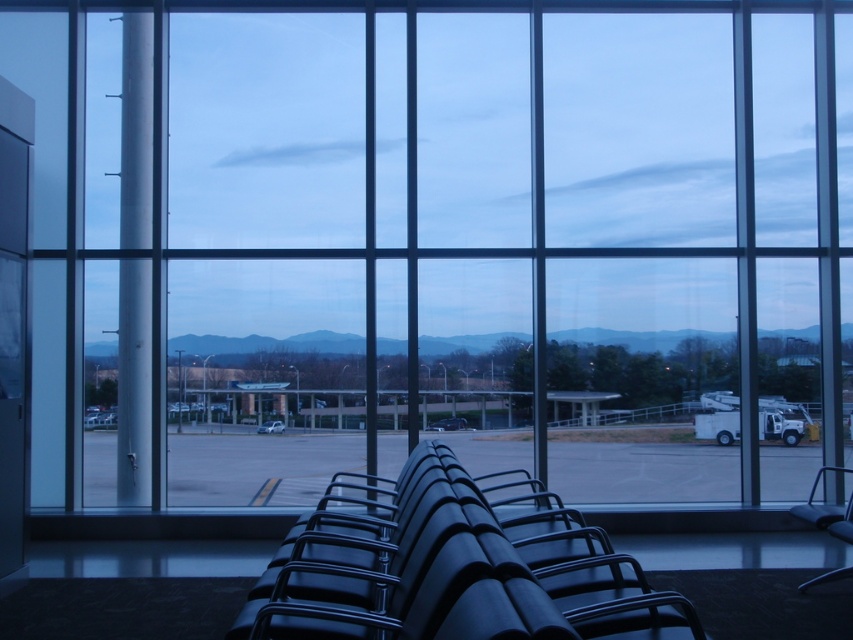
Question: Which point is farther to the camera?

Choices:
 (A) matte black chair at center
 (B) smooth concrete runway at center

Answer: (B)

Question: Considering the relative positions of matte black chair at center and smooth concrete runway at center in the image provided, where is matte black chair at center located with respect to smooth concrete runway at center?

Choices:
 (A) right
 (B) left

Answer: (B)

Question: Can you confirm if matte black chair at center is positioned to the left of smooth concrete runway at center?

Choices:
 (A) no
 (B) yes

Answer: (B)

Question: In this image, where is matte black chair at center located relative to smooth concrete runway at center?

Choices:
 (A) left
 (B) right

Answer: (A)

Question: Which of the following is the farthest from the observer?

Choices:
 (A) smooth concrete runway at center
 (B) matte black chair at center

Answer: (A)